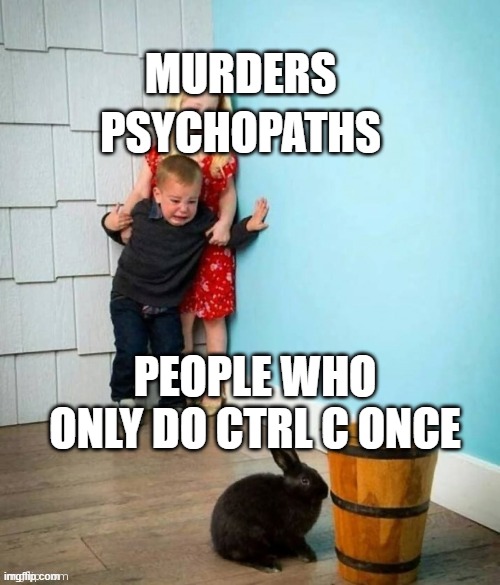
Find the location of a particular element. wood floor is located at coordinates (112, 490).